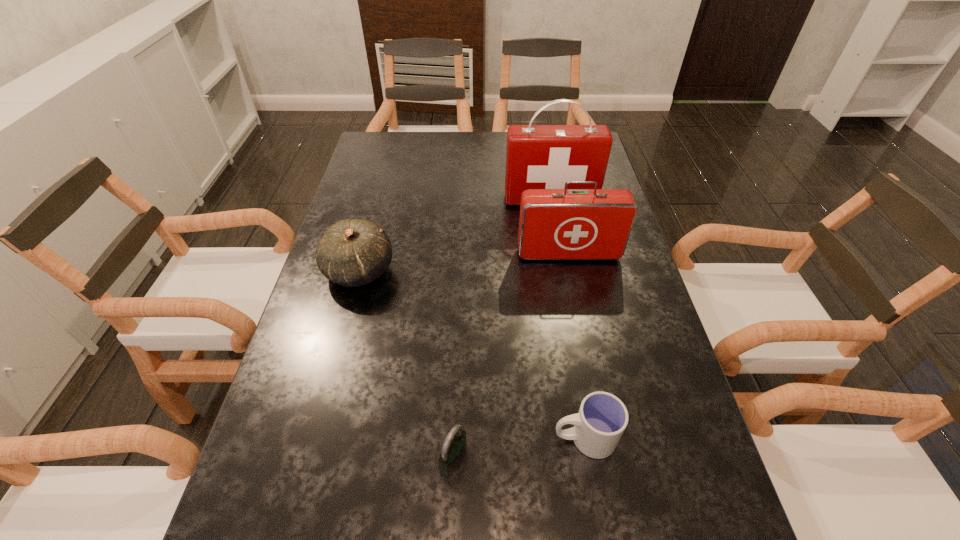
You are a GUI agent. You are given a task and a screenshot of the screen. Output one action in this format:
    pyautogui.click(x=<x>, y=<y>)
    Task: Click on the free space at the far left corner of the desktop
    This screenshot has width=960, height=540.
    Given the screenshot: What is the action you would take?
    pyautogui.click(x=407, y=136)

The width and height of the screenshot is (960, 540). I want to click on empty location between the cup and the farther first-aid kit, so click(x=567, y=319).

The width and height of the screenshot is (960, 540). Find the location of `free space between the third shortest object and the nearer first-aid kit`. free space between the third shortest object and the nearer first-aid kit is located at coordinates (464, 262).

This screenshot has width=960, height=540. What are the coordinates of `blank region between the shorter first-aid kit and the cup` in the screenshot? It's located at (576, 346).

Find the location of a particular element. The width and height of the screenshot is (960, 540). blank region between the farther first-aid kit and the cup is located at coordinates (567, 319).

I want to click on free space between the cup and the farthest object, so click(567, 319).

Locate an element on the screen. vacant space that's between the second tallest object and the cup is located at coordinates (576, 346).

The image size is (960, 540). Identify the location of vacant area that lies between the farthest object and the padlock. pos(502,330).

You are a GUI agent. You are given a task and a screenshot of the screen. Output one action in this format:
    pyautogui.click(x=<x>, y=<y>)
    Task: Click on the empty space that is in between the tallest object and the fourth object from right to left
    
    Given the screenshot: What is the action you would take?
    pyautogui.click(x=502, y=330)

This screenshot has width=960, height=540. In order to click on free space between the second tallest object and the second object from left to right in this screenshot , I will do `click(511, 357)`.